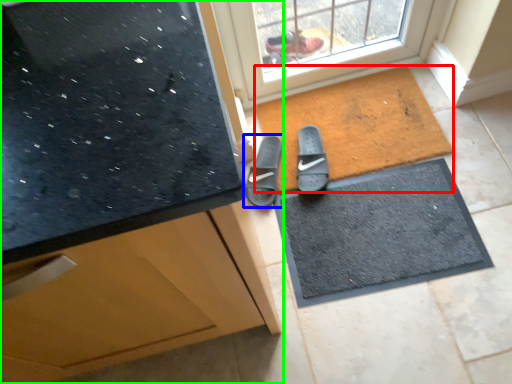
Question: Which object is positioned closest to mat (highlighted by a red box)? Select from footwear (highlighted by a blue box) and cabinetry (highlighted by a green box).

Choices:
 (A) footwear
 (B) cabinetry

Answer: (A)